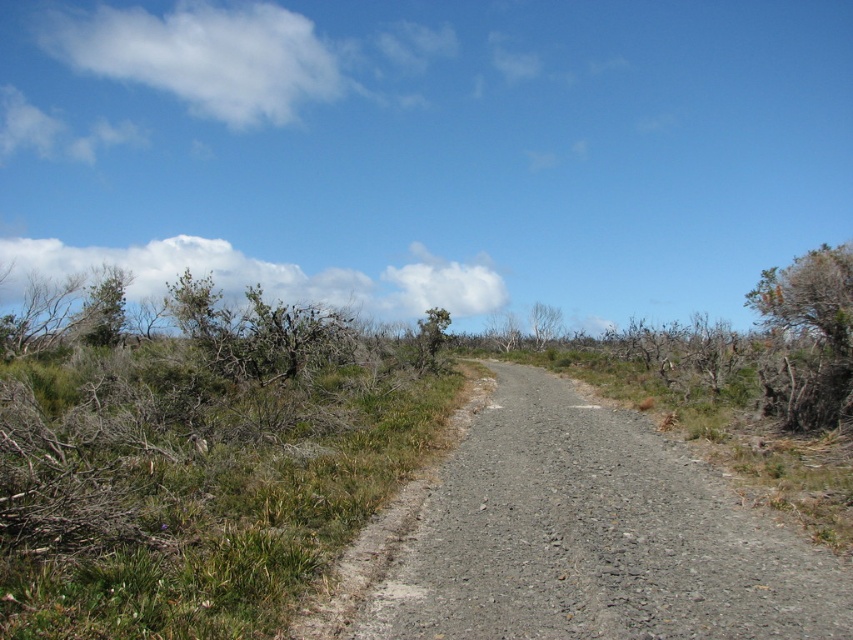
You are standing at the starting point of the gravel path in the rural scene. You see two points marked on the path ahead of you. The first point is at coordinates point (809, 280) and the second point is at point (527, 316). Which point is closer to your current position?

Point (809, 280) is closer to the camera than point (527, 316), so the first point is closer to your current position.

You are a hiker walking along the gravel path and need to decide whether to stay on the path or step off to the right. Considering the brown textured bush at right and the bare branches at center, which side has an object closer to you that might affect your path?

The brown textured bush at right is closer to the viewer than the bare branches at center, so stepping off to the right might be affected by the closer brown textured bush at right.